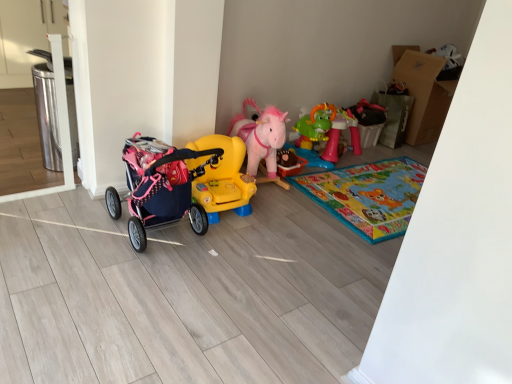
Question: Is yellow plastic ride-on car at center, the 2th toy positioned from the left, shorter than rubberized green dinosaur table at center-right, which ranks as the 4th toy in left-to-right order?

Choices:
 (A) no
 (B) yes

Answer: (B)

Question: Is rubberized green dinosaur table at center-right, acting as the first toy starting from the right, at the back of yellow plastic ride-on car at center, which is the third toy in right-to-left order?

Choices:
 (A) yes
 (B) no

Answer: (B)

Question: Is the surface of yellow plastic ride-on car at center, the 2th toy positioned from the left, in direct contact with rubberized green dinosaur table at center-right, which ranks as the 4th toy in left-to-right order?

Choices:
 (A) no
 (B) yes

Answer: (A)

Question: From a real-world perspective, does yellow plastic ride-on car at center, which is the third toy in right-to-left order, sit lower than rubberized green dinosaur table at center-right, acting as the first toy starting from the right?

Choices:
 (A) no
 (B) yes

Answer: (B)

Question: From the image's perspective, is yellow plastic ride-on car at center, which is the third toy in right-to-left order, located beneath rubberized green dinosaur table at center-right, which ranks as the 4th toy in left-to-right order?

Choices:
 (A) yes
 (B) no

Answer: (A)

Question: Does point (269, 155) appear closer or farther from the camera than point (154, 198)?

Choices:
 (A) closer
 (B) farther

Answer: (B)

Question: From the image's perspective, relative to pink fabric stroller at left, the 1th toy when ordered from left to right, is pink plush horse at center, marked as the 2th toy in a right-to-left arrangement, above or below?

Choices:
 (A) above
 (B) below

Answer: (A)

Question: Considering the positions of pink plush horse at center, marked as the 2th toy in a right-to-left arrangement, and pink fabric stroller at left, which is counted as the 4th toy, starting from the right, in the image, is pink plush horse at center, marked as the 2th toy in a right-to-left arrangement, wider or thinner than pink fabric stroller at left, which is counted as the 4th toy, starting from the right,?

Choices:
 (A) wide
 (B) thin

Answer: (A)

Question: Based on their positions, is pink plush horse at center, marked as the 2th toy in a right-to-left arrangement, located to the left or right of pink fabric stroller at left, which is counted as the 4th toy, starting from the right?

Choices:
 (A) right
 (B) left

Answer: (A)

Question: Is rubberized green dinosaur table at center-right, which ranks as the 4th toy in left-to-right order, in front of or behind yellow plastic ride-on car at center, which is the third toy in right-to-left order, in the image?

Choices:
 (A) front
 (B) behind

Answer: (B)

Question: Looking at the image, does rubberized green dinosaur table at center-right, which ranks as the 4th toy in left-to-right order, seem bigger or smaller compared to yellow plastic ride-on car at center, the 2th toy positioned from the left?

Choices:
 (A) small
 (B) big

Answer: (B)

Question: Based on their positions, is rubberized green dinosaur table at center-right, acting as the first toy starting from the right, located to the left or right of yellow plastic ride-on car at center, the 2th toy positioned from the left?

Choices:
 (A) right
 (B) left

Answer: (A)

Question: In terms of height, does rubberized green dinosaur table at center-right, acting as the first toy starting from the right, look taller or shorter compared to yellow plastic ride-on car at center, the 2th toy positioned from the left?

Choices:
 (A) tall
 (B) short

Answer: (A)

Question: Considering the positions of point (275, 175) and point (324, 122), is point (275, 175) closer or farther from the camera than point (324, 122)?

Choices:
 (A) farther
 (B) closer

Answer: (B)

Question: Is pink plush horse at center, placed as the third toy when sorted from left to right, bigger or smaller than rubberized green dinosaur table at center-right, acting as the first toy starting from the right?

Choices:
 (A) small
 (B) big

Answer: (B)